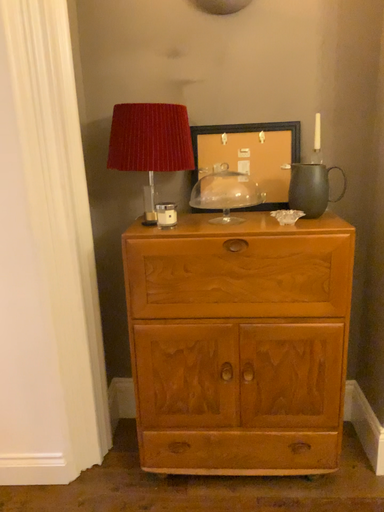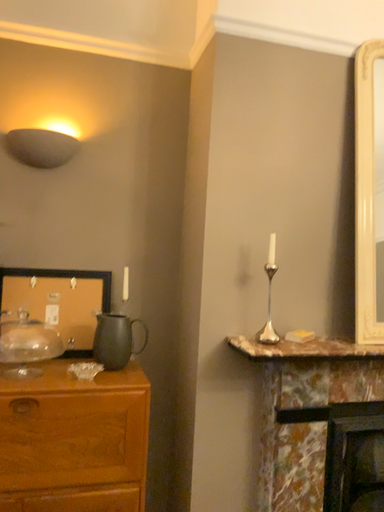
Question: Which way did the camera rotate in the video?

Choices:
 (A) rotated upward
 (B) rotated downward

Answer: (A)